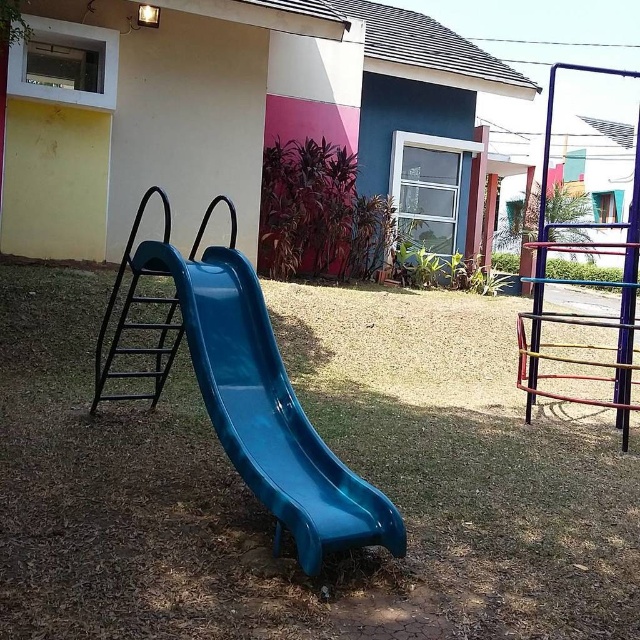
Is green grass at center above black metal ladder at left?

No.

Who is positioned more to the right, green grass at center or black metal ladder at left?

From the viewer's perspective, green grass at center appears more on the right side.

You are a GUI agent. You are given a task and a screenshot of the screen. Output one action in this format:
    pyautogui.click(x=<x>, y=<y>)
    Task: Click on the green grass at center
    The width and height of the screenshot is (640, 640).
    Given the screenshot: What is the action you would take?
    pyautogui.click(x=337, y=452)

Locate an element on the screen. Image resolution: width=640 pixels, height=640 pixels. green grass at center is located at coordinates (337, 452).

Which is more to the left, green grass at center or glossy plastic slide at center?

From the viewer's perspective, glossy plastic slide at center appears more on the left side.

Is point (42, 380) positioned behind point (144, 243)?

Yes, point (42, 380) is behind point (144, 243).

Consider the image. Who is more distant from viewer, (60,496) or (352,474)?

The point (60,496) is more distant.

Identify the location of green grass at center. This screenshot has width=640, height=640. (337, 452).

Is glossy plastic slide at center further to the viewer compared to black metal ladder at left?

That is False.

Can you confirm if glossy plastic slide at center is positioned to the right of black metal ladder at left?

Correct, you'll find glossy plastic slide at center to the right of black metal ladder at left.

Measure the distance between glossy plastic slide at center and camera.

glossy plastic slide at center and camera are 2.35 meters apart from each other.

This screenshot has height=640, width=640. What are the coordinates of `glossy plastic slide at center` in the screenshot? It's located at (266, 410).